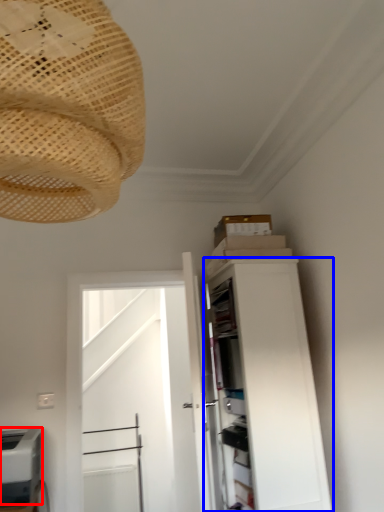
Question: Which object is closer to the camera taking this photo, appliance (highlighted by a red box) or cabinetry (highlighted by a blue box)?

Choices:
 (A) appliance
 (B) cabinetry

Answer: (A)